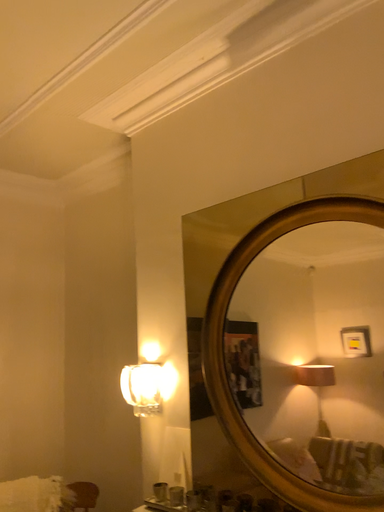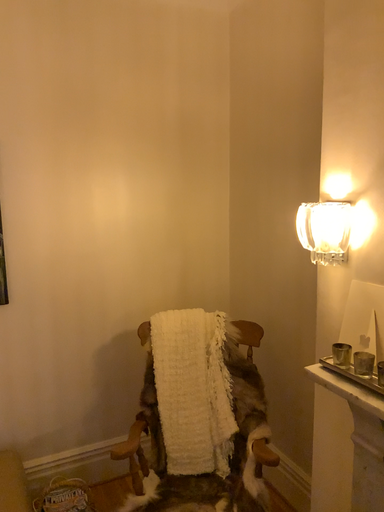
Question: Which way did the camera rotate in the video?

Choices:
 (A) rotated left
 (B) rotated right

Answer: (A)